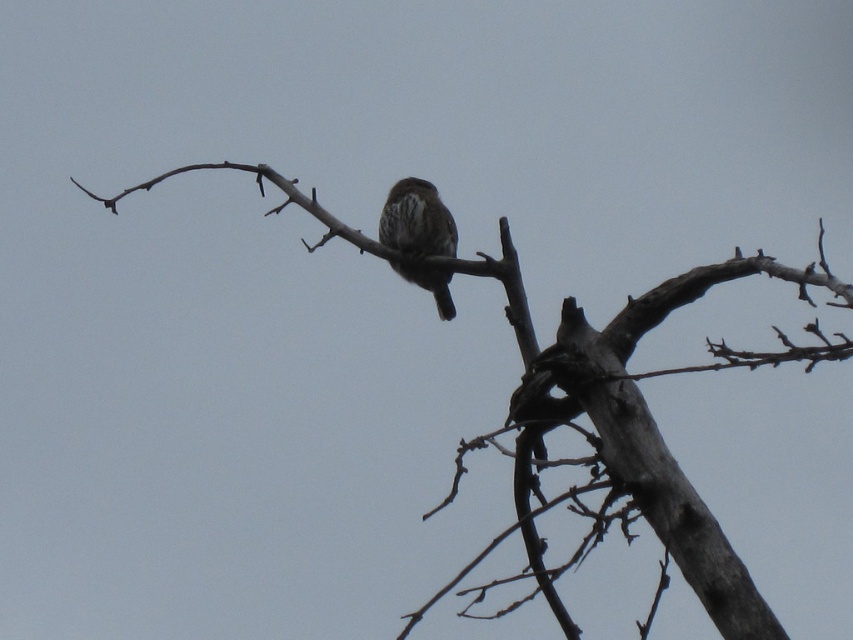
You are an ornithologist observing the brown speckled bird at center perched on the brown textured branch at center. Based on the scene, which object occupies more space in the image?

The brown textured branch at center is larger in size than the brown speckled bird at center, so it occupies more space in the image.

You are a photographer adjusting your camera settings. You have two points in your viewfinder, point 1 at coordinates point (503, 532) and point 2 at coordinates point (440, 310). Which point is closer to your camera lens?

Point (503, 532) is closer to the camera lens than point (440, 310).